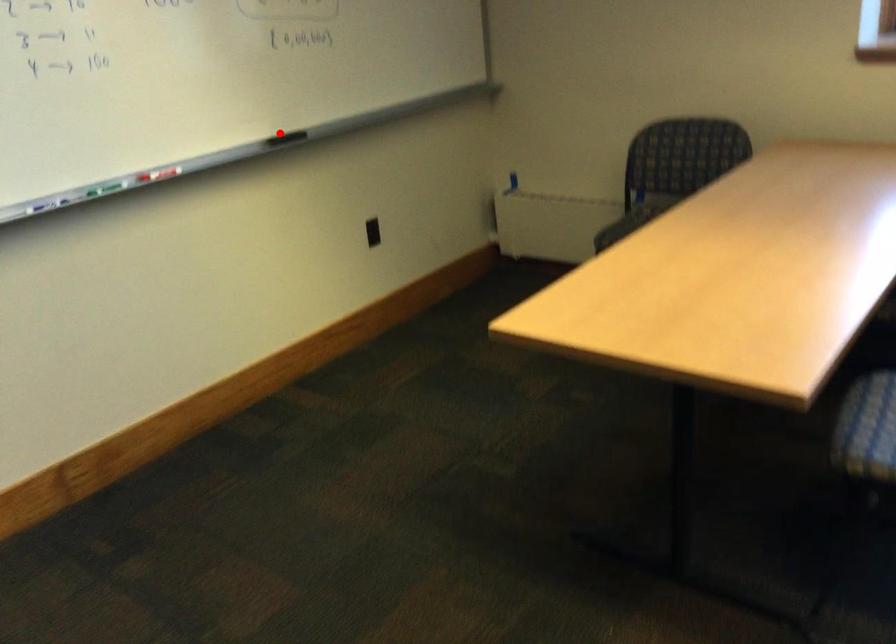
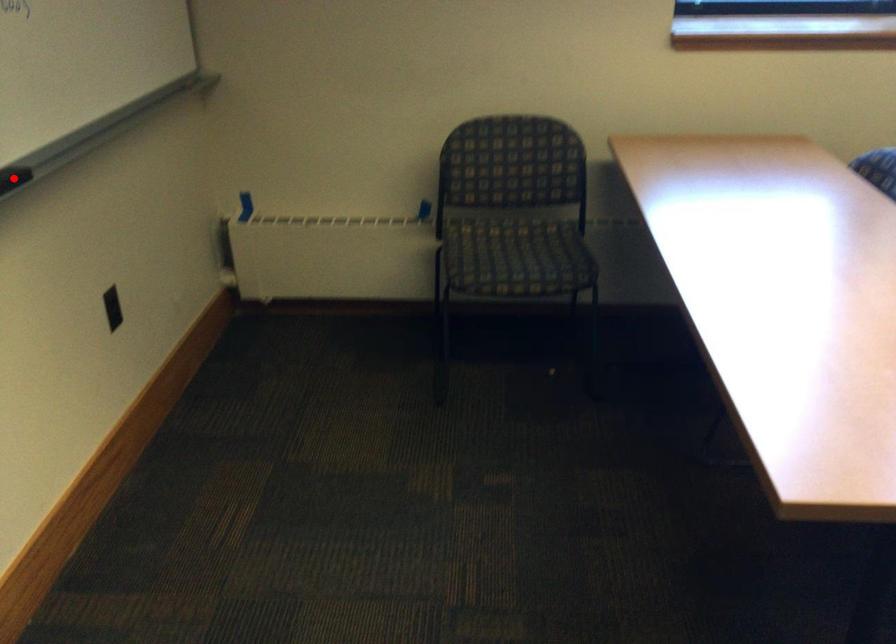
I am providing you with two images of the same scene from different viewpoints. A red point is marked on the first image and another point is marked on the second image. Is the marked point in image1 the same physical position as the marked point in image2?

Yes